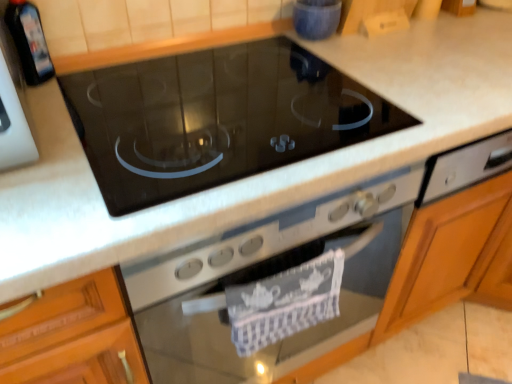
Question: Would you say blue glossy bowl at upper center, positioned as the first appliance in right-to-left order, is to the left or to the right of black glass bottle at upper left, positioned as the 2th appliance in back-to-front order, in the picture?

Choices:
 (A) right
 (B) left

Answer: (A)

Question: Is blue glossy bowl at upper center, positioned as the first appliance in back-to-front order, bigger or smaller than black glass bottle at upper left, the first appliance viewed from the front?

Choices:
 (A) big
 (B) small

Answer: (A)

Question: Estimate the real-world distances between objects in this image. Which object is farther from the black glass bottle at upper left, the first appliance viewed from the front?

Choices:
 (A) blue glossy bowl at upper center, acting as the 2th appliance starting from the left
 (B) black glass cooktop at center
 (C) black glass cooktop at center

Answer: (C)

Question: Considering the real-world distances, which object is farthest from the black glass cooktop at center?

Choices:
 (A) blue glossy bowl at upper center, acting as the 2th appliance starting from the left
 (B) black glass bottle at upper left, the first appliance viewed from the front
 (C) black glass cooktop at center

Answer: (B)